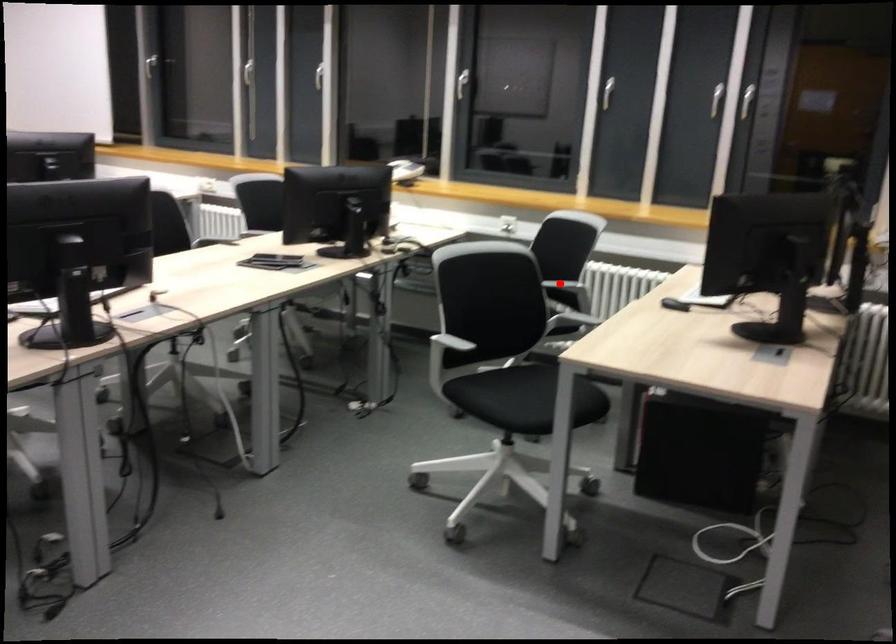
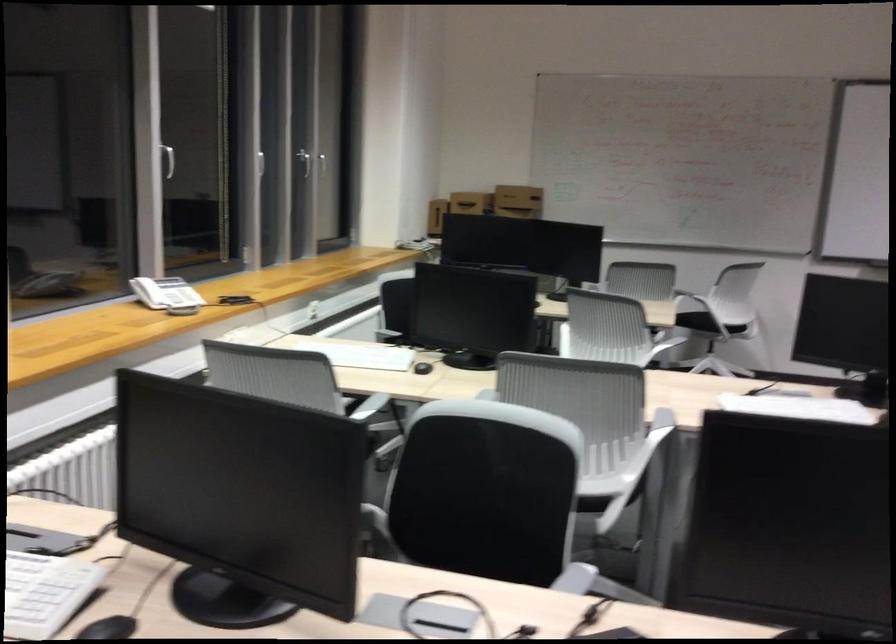
Question: I am providing you with two images of the same scene from different viewpoints. A red point is marked on the first image. Is the red point's position out of view in image 2?

Choices:
 (A) Yes
 (B) No

Answer: (A)